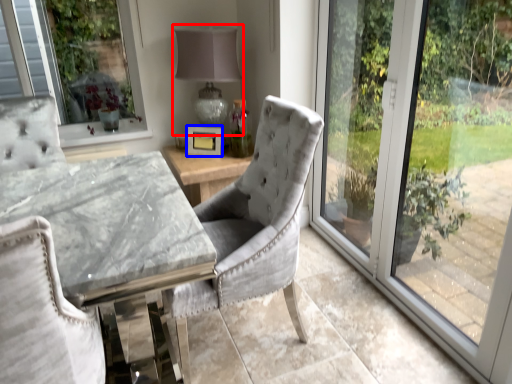
Question: Among these objects, which one is farthest to the camera, table lamp (highlighted by a red box) or picture frame (highlighted by a blue box)?

Choices:
 (A) table lamp
 (B) picture frame

Answer: (B)